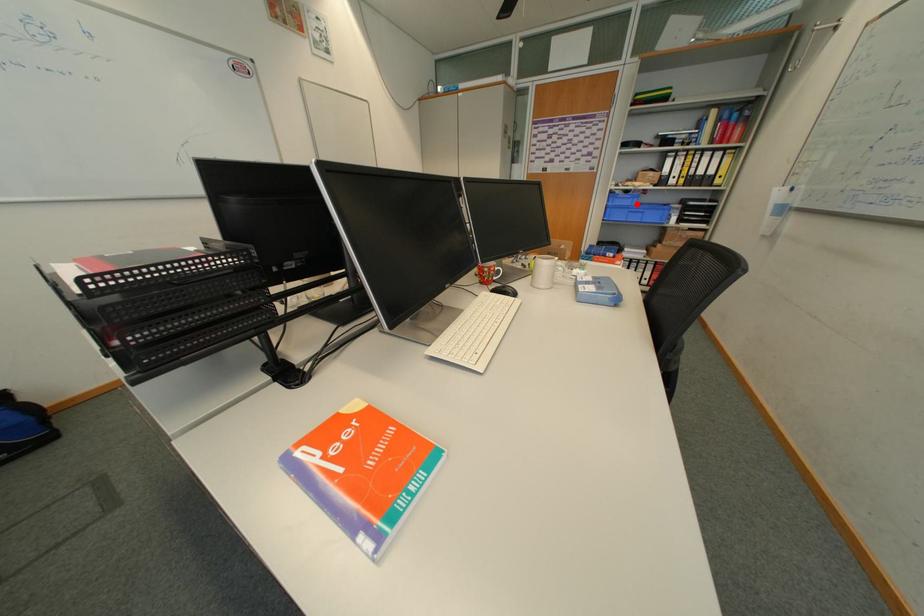
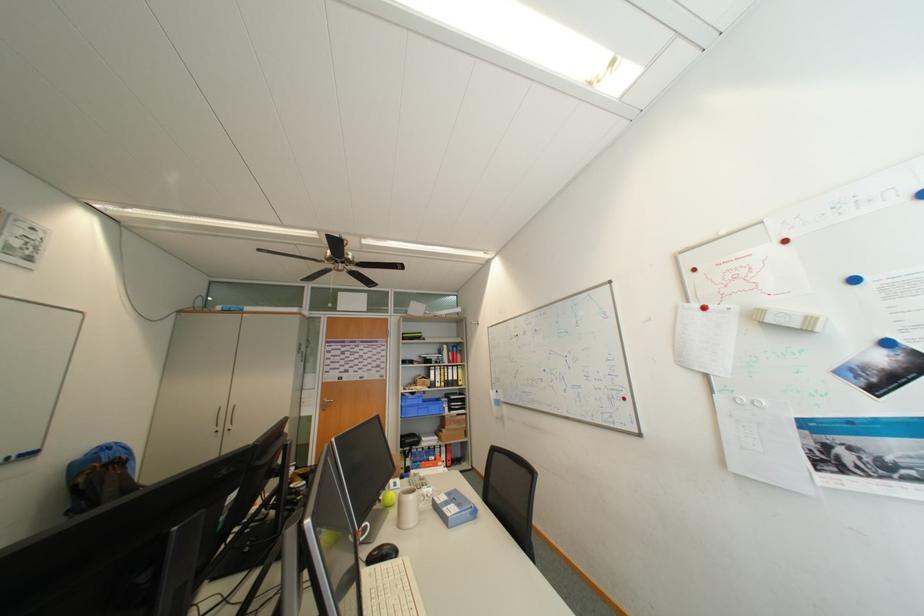
Question: I am providing you with two images of the same scene from different viewpoints. A red point is shown in image1. For the corresponding object point in image2, is it positioned nearer or farther from the camera?

Choices:
 (A) Nearer
 (B) Farther

Answer: (B)